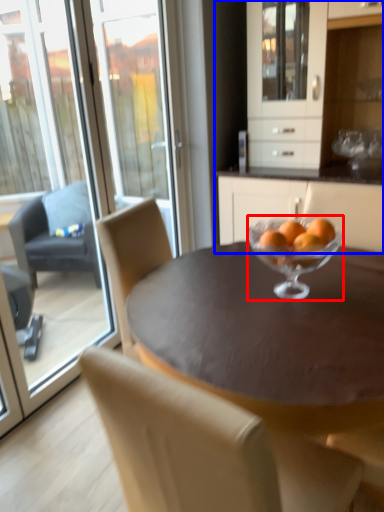
Question: Which object appears farthest to the camera in this image, martini glass (highlighted by a red box) or cabinetry (highlighted by a blue box)?

Choices:
 (A) martini glass
 (B) cabinetry

Answer: (B)